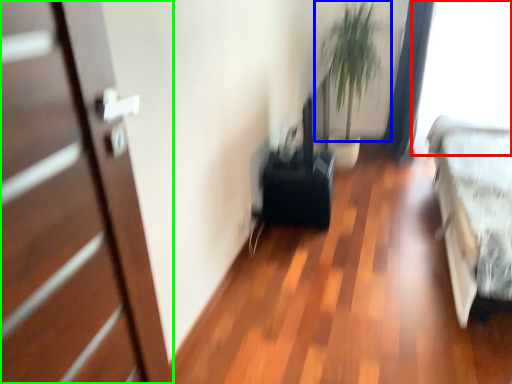
Question: Based on their relative distances, which object is farther from window screen (highlighted by a red box)? Choose from plant (highlighted by a blue box) and door (highlighted by a green box).

Choices:
 (A) plant
 (B) door

Answer: (B)